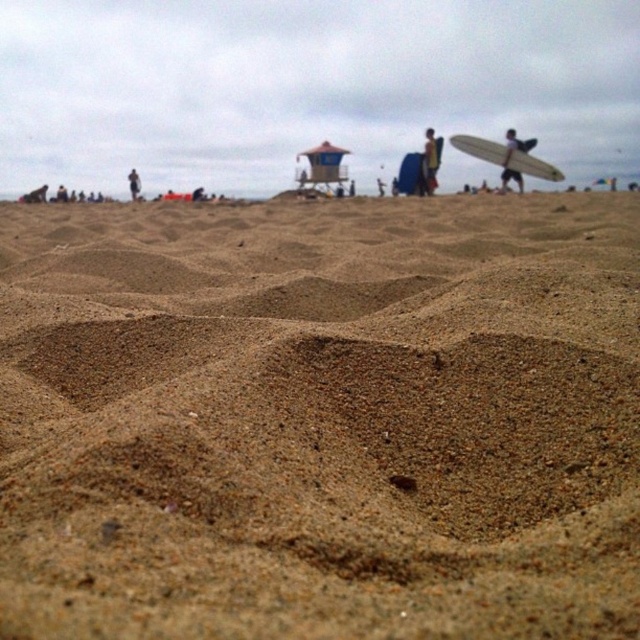
You are a photographer trying to capture the dark gray fabric at upper left and the white matte surfboard at upper right in the same frame. Based on their positions, which object would appear closer to the camera in the photo?

The white matte surfboard at upper right would appear closer to the camera because the dark gray fabric at upper left is positioned behind it.